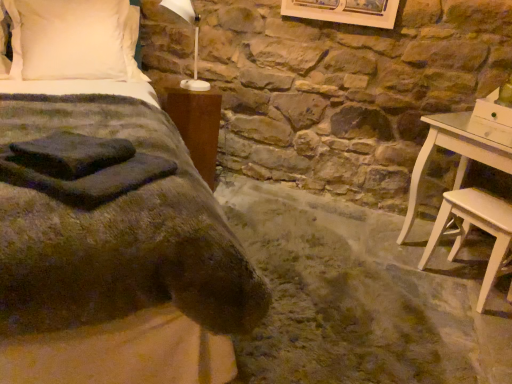
Question: Is brown wood nightstand at left to the left or to the right of dark green fabric bed at center in the image?

Choices:
 (A) right
 (B) left

Answer: (A)

Question: From a real-world perspective, is brown wood nightstand at left above or below dark green fabric bed at center?

Choices:
 (A) below
 (B) above

Answer: (A)

Question: Based on their relative distances, which object is nearer to the white soft pillow at upper left?

Choices:
 (A) brown wood nightstand at left
 (B) light wood stool at lower right
 (C) dark green fabric bed at center

Answer: (C)

Question: Based on their relative distances, which object is farther from the white soft pillow at upper left?

Choices:
 (A) brown wood nightstand at left
 (B) dark green fabric bed at center
 (C) light wood stool at lower right

Answer: (C)